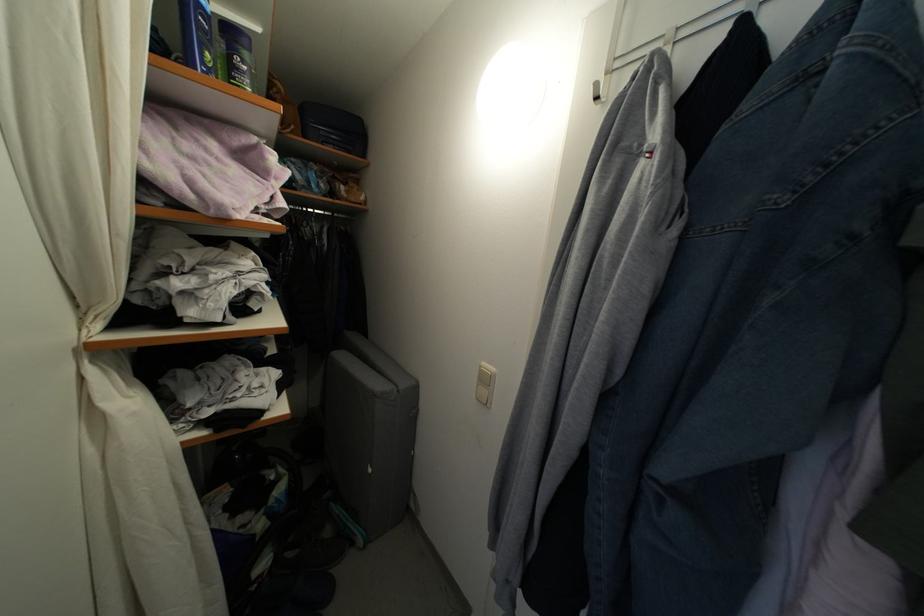
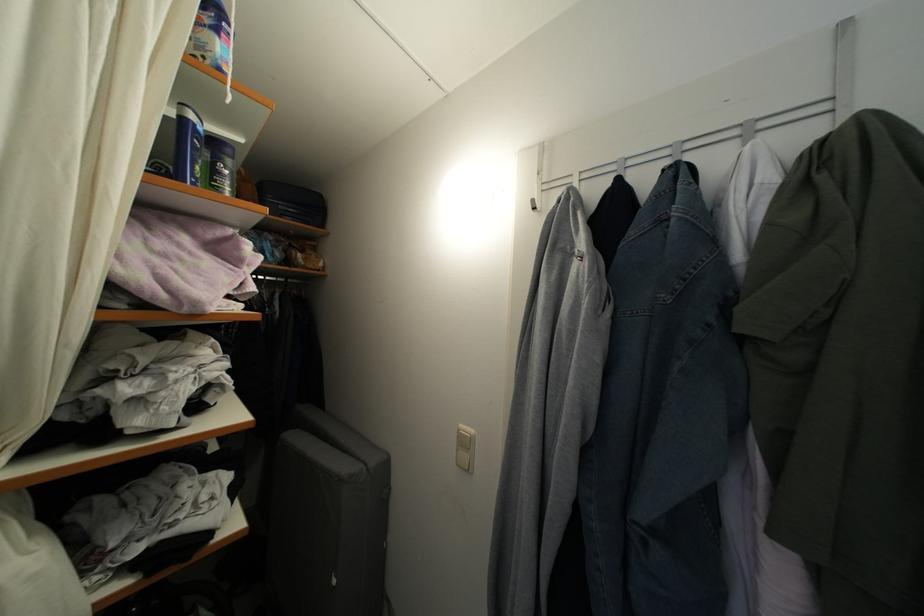
Find the pixel in the second image that matches [375,476] in the first image.

(339, 588)